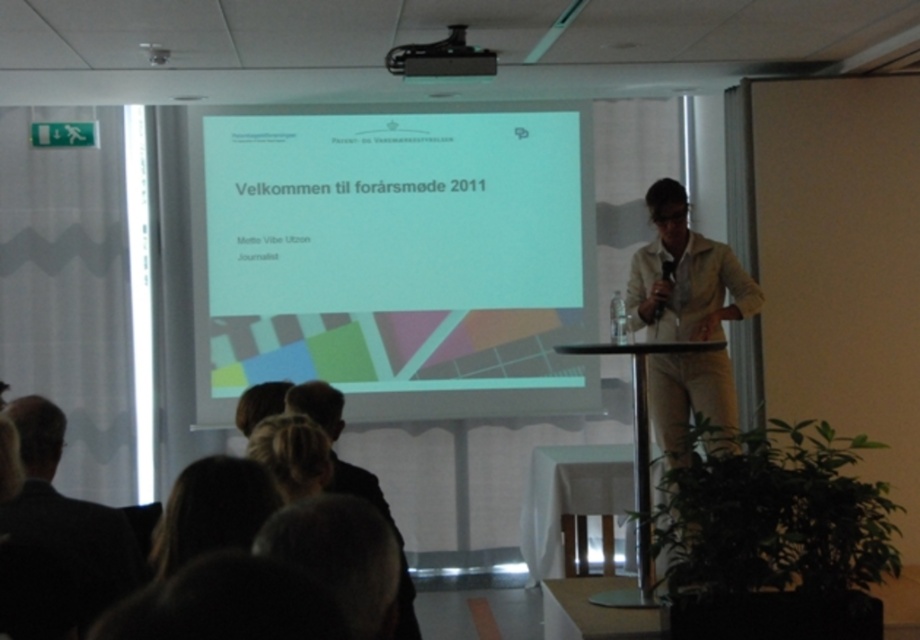
Question: Among these objects, which one is farthest from the camera?

Choices:
 (A) dark brown hair at lower center
 (B) dark suit at lower left
 (C) black plastic projector at upper center

Answer: (C)

Question: Which object is the farthest from the white matte projection screen at center?

Choices:
 (A) black plastic projector at upper center
 (B) dark suit at lower left

Answer: (B)

Question: Is dark brown hair at lower center behind black plastic projector at upper center?

Choices:
 (A) yes
 (B) no

Answer: (B)

Question: Is dark suit at lower left wider than dark brown hair at lower center?

Choices:
 (A) no
 (B) yes

Answer: (B)

Question: Is white matte projection screen at center to the left of dark suit at lower left from the viewer's perspective?

Choices:
 (A) no
 (B) yes

Answer: (A)

Question: Which object is farther from the camera taking this photo?

Choices:
 (A) dark suit at lower left
 (B) dark brown hair at lower center
 (C) white matte projection screen at center
 (D) black plastic projector at upper center

Answer: (C)